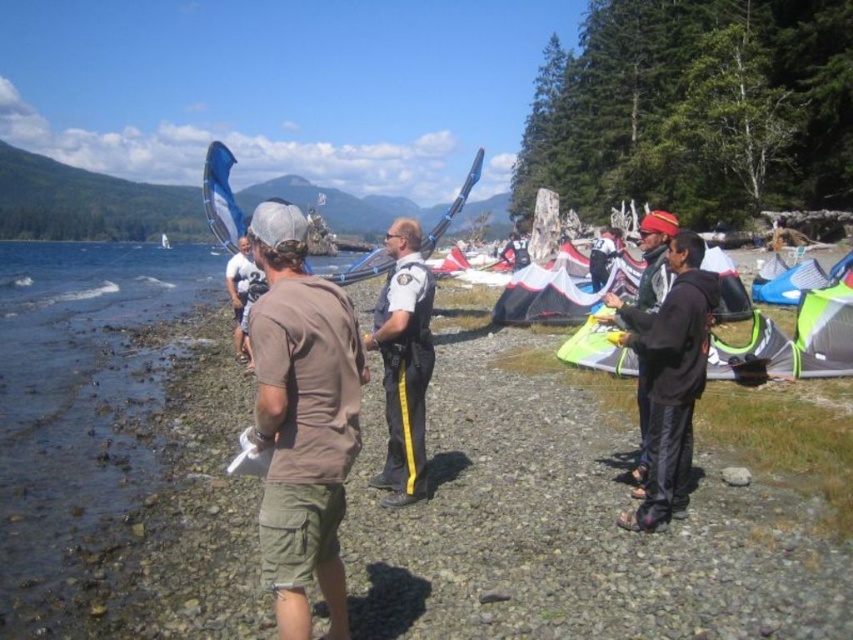
This screenshot has height=640, width=853. Describe the element at coordinates (302, 419) in the screenshot. I see `brown cotton t-shirt at center` at that location.

How much distance is there between brown cotton t-shirt at center and blue fabric tent at center right?

The distance of brown cotton t-shirt at center from blue fabric tent at center right is 16.71 meters.

Does point (293, 605) come farther from viewer compared to point (817, 280)?

No.

In order to click on brown cotton t-shirt at center in this screenshot , I will do coord(302,419).

Between point (251, 332) and point (701, 285), which one is positioned in front?

Positioned in front is point (251, 332).

Does point (260, 266) come behind point (682, 237)?

No, it is in front of (682, 237).

In order to click on brown cotton t-shirt at center in this screenshot , I will do `click(302, 419)`.

Is point (691, 291) less distant than point (769, 285)?

Yes, point (691, 291) is closer to viewer.

Which of these two, black matte jacket at right or blue fabric tent at center right, stands shorter?

With less height is blue fabric tent at center right.

Does point (630, 516) come farther from viewer compared to point (805, 284)?

No, (630, 516) is in front of (805, 284).

You are a GUI agent. You are given a task and a screenshot of the screen. Output one action in this format:
    pyautogui.click(x=<x>, y=<y>)
    Task: Click on the black matte jacket at right
    The image size is (853, 640).
    Given the screenshot: What is the action you would take?
    pyautogui.click(x=670, y=378)